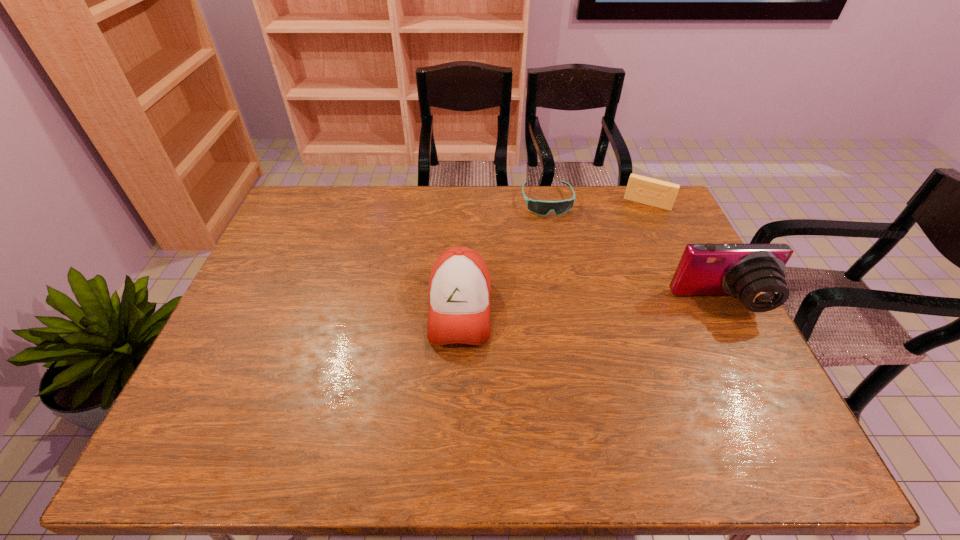
The image size is (960, 540). In order to click on free space at the far left corner of the desktop in this screenshot , I will do `click(331, 213)`.

Where is `free space at the near left corner of the desktop`? free space at the near left corner of the desktop is located at coordinates (221, 389).

This screenshot has height=540, width=960. I want to click on free spot between the shortest object and the camera, so click(x=635, y=253).

Find the location of a particular element. Image resolution: width=960 pixels, height=540 pixels. free area in between the sunglasses and the videotape is located at coordinates (597, 202).

Find the location of `vacant point located between the baseball cap and the videotape`. vacant point located between the baseball cap and the videotape is located at coordinates (554, 256).

I want to click on empty location between the sunglasses and the camera, so click(635, 253).

The width and height of the screenshot is (960, 540). What are the coordinates of `free space between the baseball cap and the videotape` in the screenshot? It's located at (554, 256).

Identify the location of unoccupied position between the third object from right to left and the camera. (635, 253).

The width and height of the screenshot is (960, 540). Find the location of `free area in between the camera and the baseball cap`. free area in between the camera and the baseball cap is located at coordinates pos(591,307).

Locate an element on the screen. object that stands as the closest to the videotape is located at coordinates (539, 207).